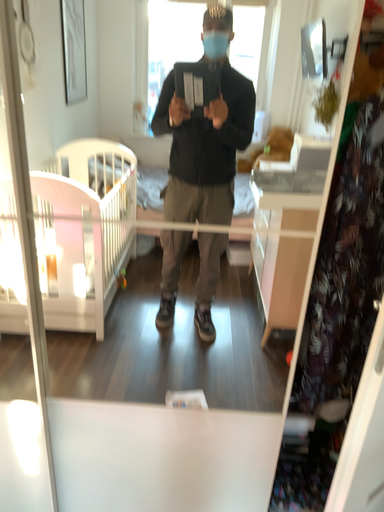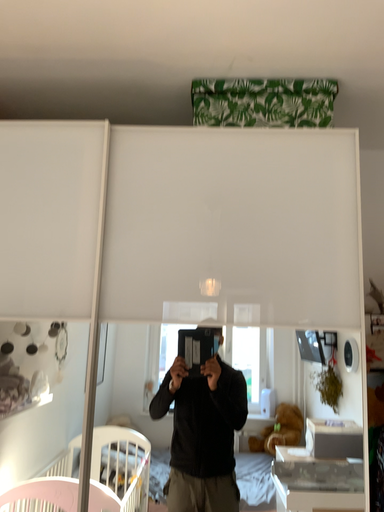
Question: How did the camera likely rotate when shooting the video?

Choices:
 (A) rotated upward
 (B) rotated downward

Answer: (A)